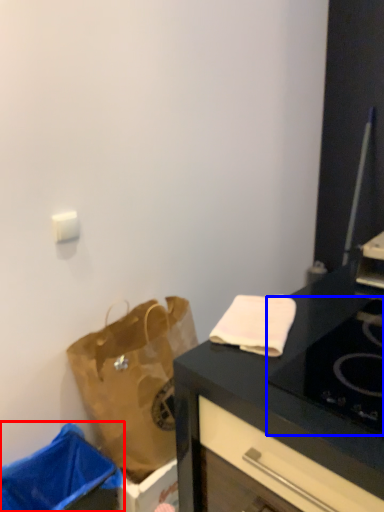
Question: Among these objects, which one is farthest to the camera, trash bin/can (highlighted by a red box) or gas stove (highlighted by a blue box)?

Choices:
 (A) trash bin/can
 (B) gas stove

Answer: (A)